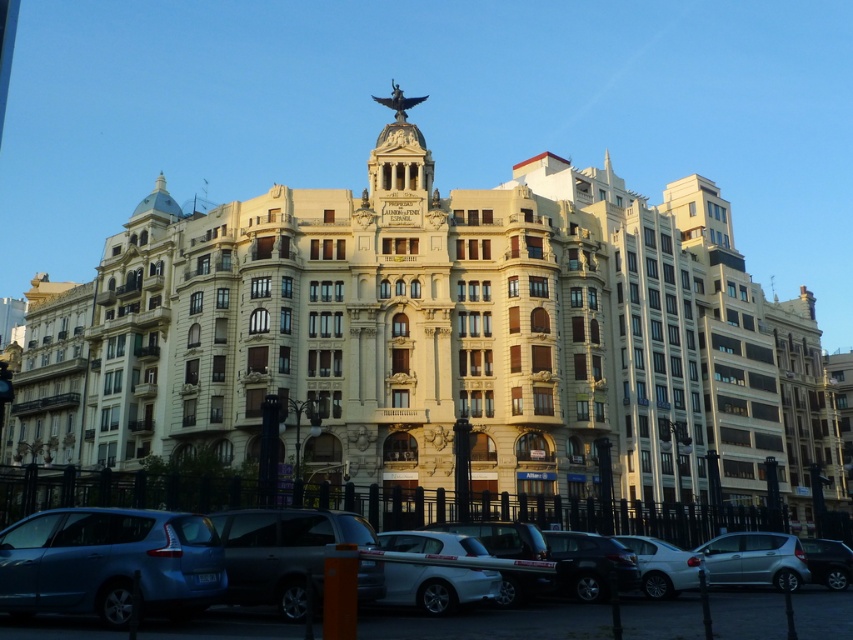
Question: Which is farther from the satin blue minivan at lower left?

Choices:
 (A) matte black car at lower center
 (B) white glossy sedan at center
 (C) white glossy car at lower center
 (D) shiny black car at lower center

Answer: (B)

Question: Which of these objects is positioned farthest from the satin blue minivan at lower left?

Choices:
 (A) matte black car at lower right
 (B) shiny black car at lower center
 (C) satin silver car at lower right

Answer: (A)

Question: Is matte black van at center bigger than satin silver car at lower right?

Choices:
 (A) no
 (B) yes

Answer: (A)

Question: Is matte black car at lower center positioned behind shiny black car at lower center?

Choices:
 (A) yes
 (B) no

Answer: (B)

Question: Does satin blue minivan at lower left appear over white glossy car at lower center?

Choices:
 (A) no
 (B) yes

Answer: (B)

Question: Which point is closer to the camera?

Choices:
 (A) (837, 548)
 (B) (460, 548)
 (C) (51, 620)
 (D) (751, 550)

Answer: (C)